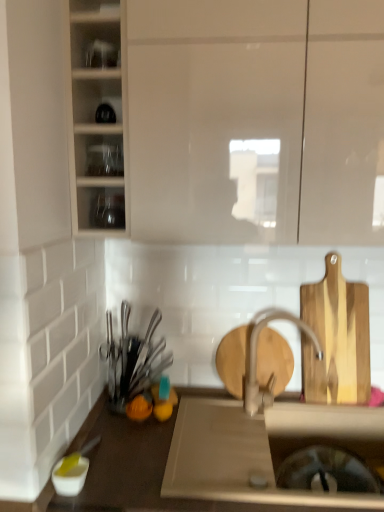
Question: Does matte silver faucet at center have a larger size compared to matte white cabinet at upper left, which appears as the second cabinetry when viewed from the right?

Choices:
 (A) yes
 (B) no

Answer: (B)

Question: From the image's perspective, does matte silver faucet at center appear lower than matte white cabinet at upper left, positioned as the first cabinetry in left-to-right order?

Choices:
 (A) yes
 (B) no

Answer: (A)

Question: Does matte silver faucet at center contain matte white cabinet at upper left, positioned as the first cabinetry in left-to-right order?

Choices:
 (A) yes
 (B) no

Answer: (B)

Question: Is matte silver faucet at center thinner than matte white cabinet at upper left, which appears as the second cabinetry when viewed from the right?

Choices:
 (A) yes
 (B) no

Answer: (A)

Question: Could you tell me if matte silver faucet at center is turned towards matte white cabinet at upper left, which appears as the second cabinetry when viewed from the right?

Choices:
 (A) yes
 (B) no

Answer: (B)

Question: From the image's perspective, is matte silver faucet at center above matte white cabinet at upper left, which appears as the second cabinetry when viewed from the right?

Choices:
 (A) no
 (B) yes

Answer: (A)

Question: Is white matte sink at center not close to matte silver faucet at center?

Choices:
 (A) no
 (B) yes

Answer: (A)

Question: Does white matte sink at center have a smaller size compared to matte silver faucet at center?

Choices:
 (A) yes
 (B) no

Answer: (B)

Question: From the image's perspective, is white matte sink at center below matte silver faucet at center?

Choices:
 (A) no
 (B) yes

Answer: (B)

Question: Is white matte sink at center in contact with matte silver faucet at center?

Choices:
 (A) no
 (B) yes

Answer: (A)

Question: Can you confirm if white matte sink at center is positioned to the left of matte silver faucet at center?

Choices:
 (A) no
 (B) yes

Answer: (B)

Question: Considering the relative sizes of white matte sink at center and matte silver faucet at center in the image provided, is white matte sink at center thinner than matte silver faucet at center?

Choices:
 (A) yes
 (B) no

Answer: (B)

Question: Is wooden cutting board at right located within matte white cabinet at upper left, which appears as the second cabinetry when viewed from the right?

Choices:
 (A) no
 (B) yes

Answer: (A)